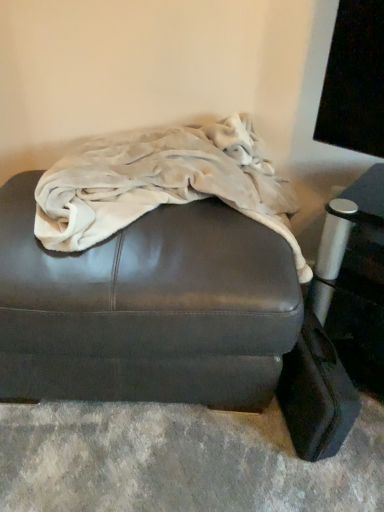
This screenshot has width=384, height=512. Describe the element at coordinates (316, 394) in the screenshot. I see `black leather suitcase at lower right` at that location.

Describe the element at coordinates (161, 183) in the screenshot. I see `beige fleece blanket at center` at that location.

This screenshot has height=512, width=384. I want to click on black leather suitcase at lower right, so click(x=316, y=394).

Is beige fleece blanket at center facing towards black leather suitcase at lower right?

No, beige fleece blanket at center does not turn towards black leather suitcase at lower right.

Who is taller, beige fleece blanket at center or black leather suitcase at lower right?

Standing taller between the two is beige fleece blanket at center.

Between point (167, 199) and point (313, 392), which one is positioned in front?

The point (313, 392) is in front.

Considering the points (228, 149) and (241, 288), which point is in front, point (228, 149) or point (241, 288)?

Positioned in front is point (241, 288).

From the image's perspective, which one is positioned higher, beige fleece blanket at center or matte brown leather ottoman at center?

beige fleece blanket at center.

Does beige fleece blanket at center contain matte brown leather ottoman at center?

No.

Would you say beige fleece blanket at center is a long distance from matte brown leather ottoman at center?

beige fleece blanket at center is near matte brown leather ottoman at center, not far away.

Is matte brown leather ottoman at center looking in the opposite direction of black leather suitcase at lower right?

No.

How different are the orientations of matte brown leather ottoman at center and black leather suitcase at lower right in degrees?

7.05 degrees separate the facing orientations of matte brown leather ottoman at center and black leather suitcase at lower right.

Which object is further away from the camera, matte brown leather ottoman at center or black leather suitcase at lower right?

black leather suitcase at lower right is further away from the camera.

From the image's perspective, is matte brown leather ottoman at center over black leather suitcase at lower right?

Correct, matte brown leather ottoman at center appears higher than black leather suitcase at lower right in the image.

Consider the image. Can you confirm if black leather suitcase at lower right is positioned to the left of matte brown leather ottoman at center?

In fact, black leather suitcase at lower right is to the right of matte brown leather ottoman at center.

Considering the sizes of black leather suitcase at lower right and matte brown leather ottoman at center in the image, is black leather suitcase at lower right wider or thinner than matte brown leather ottoman at center?

black leather suitcase at lower right is thinner than matte brown leather ottoman at center.

Can you confirm if black leather suitcase at lower right is smaller than matte brown leather ottoman at center?

Indeed, black leather suitcase at lower right has a smaller size compared to matte brown leather ottoman at center.

Looking at their sizes, would you say black leather suitcase at lower right is wider or thinner than beige fleece blanket at center?

In the image, black leather suitcase at lower right appears to be more narrow than beige fleece blanket at center.

From the image's perspective, between black leather suitcase at lower right and beige fleece blanket at center, who is located below?

black leather suitcase at lower right.

From a real-world perspective, between black leather suitcase at lower right and beige fleece blanket at center, who is vertically higher?

In real-world perspective, beige fleece blanket at center is above.

In order to click on luggage located on the right of beige fleece blanket at center in this screenshot , I will do `click(316, 394)`.

From a real-world perspective, is matte brown leather ottoman at center physically above beige fleece blanket at center?

Actually, matte brown leather ottoman at center is physically below beige fleece blanket at center in the real world.

Can you confirm if matte brown leather ottoman at center is wider than beige fleece blanket at center?

Indeed, matte brown leather ottoman at center has a greater width compared to beige fleece blanket at center.

Based on their positions, is matte brown leather ottoman at center located to the left or right of beige fleece blanket at center?

From the image, it's evident that matte brown leather ottoman at center is to the left of beige fleece blanket at center.

What are the coordinates of `blanket located on the left of black leather suitcase at lower right` in the screenshot? It's located at (161, 183).

The image size is (384, 512). What are the coordinates of `furniture that is under the beige fleece blanket at center (from a real-world perspective)` in the screenshot? It's located at (146, 308).

In the scene shown: Considering their positions, is beige fleece blanket at center positioned closer to matte brown leather ottoman at center than black leather suitcase at lower right?

beige fleece blanket at center is closer to matte brown leather ottoman at center.

Considering their positions, is black leather suitcase at lower right positioned further to beige fleece blanket at center than matte brown leather ottoman at center?

black leather suitcase at lower right is further to beige fleece blanket at center.

Which object lies further to the anchor point black leather suitcase at lower right, beige fleece blanket at center or matte brown leather ottoman at center?

beige fleece blanket at center is positioned further to the anchor black leather suitcase at lower right.

From the image, which object appears to be nearer to black leather suitcase at lower right, matte brown leather ottoman at center or beige fleece blanket at center?

Based on the image, matte brown leather ottoman at center appears to be nearer to black leather suitcase at lower right.

Based on their spatial positions, is black leather suitcase at lower right or beige fleece blanket at center closer to matte brown leather ottoman at center?

beige fleece blanket at center.

Estimate the real-world distances between objects in this image. Which object is closer to beige fleece blanket at center, matte brown leather ottoman at center or black leather suitcase at lower right?

matte brown leather ottoman at center.

You are a GUI agent. You are given a task and a screenshot of the screen. Output one action in this format:
    pyautogui.click(x=<x>, y=<y>)
    Task: Click on the blanket located between matte brown leather ottoman at center and black leather suitcase at lower right in the left-right direction
    This screenshot has height=512, width=384.
    Given the screenshot: What is the action you would take?
    pyautogui.click(x=161, y=183)